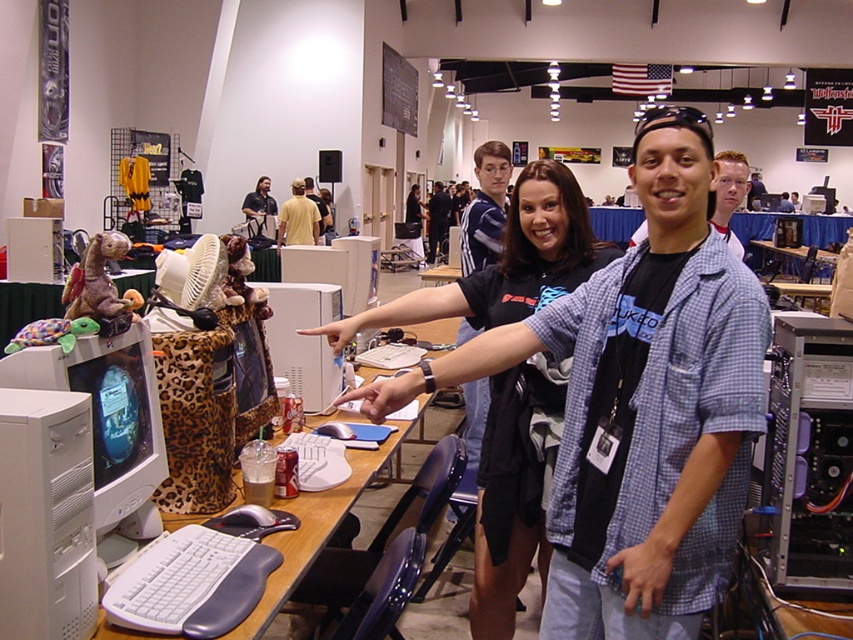
Question: Can you confirm if white plastic tower at lower left is wider than black plastic tower at center right?

Choices:
 (A) yes
 (B) no

Answer: (B)

Question: Which of the following is the closest to the observer?

Choices:
 (A) (321, 308)
 (B) (419, 243)
 (C) (256, 182)
 (D) (773, 198)

Answer: (A)

Question: Does blue plaid shirt at center appear over matte black monitor at center?

Choices:
 (A) no
 (B) yes

Answer: (A)

Question: Can you confirm if wooden table at center is bigger than black shirt at center?

Choices:
 (A) yes
 (B) no

Answer: (B)

Question: Estimate the real-world distances between objects in this image. Which object is farther from the white plastic desktop computer at center?

Choices:
 (A) wooden table at center
 (B) black shirt at center

Answer: (B)

Question: Which point is farther to the camera?

Choices:
 (A) (763, 202)
 (B) (792, 461)
 (C) (415, 193)

Answer: (C)